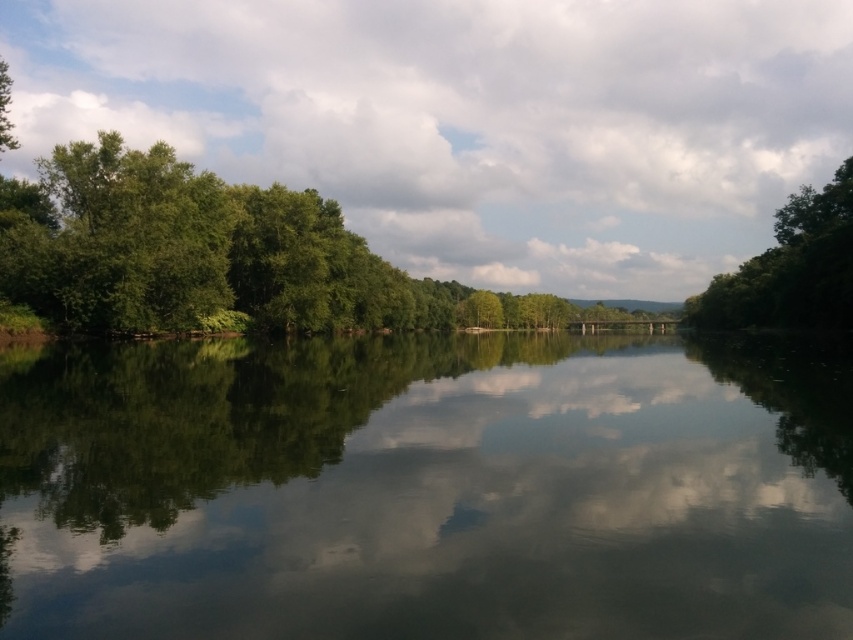
You are standing on the riverside and want to cross to the other side. The green leafy tree at upper center is blocking your view. Can you see the green reflective water at center from your current position?

Yes, because the green reflective water at center is wider than the green leafy tree at upper center, so part of the water will still be visible beyond the tree.

You are a photographer standing at the edge of the river. You want to capture the reflection of the green reflective water at center in your shot. Since reflections are best captured when the camera is positioned at the same height as the water surface, how far above or below the water level should you position your camera to ensure the reflection is clearly visible?

To capture the reflection of the green reflective water at center clearly, position your camera at the same height as the water surface. This ensures the reflection is fully visible without distortion.

You are standing at the point labeled point (729,557) and want to cross the river to the opposite bank. The bridge is 17.26 meters away from your current position. Is the bridge within a 20 meter walking distance?

The bridge is 17.26 meters away from the point labeled point (729,557), so yes, it is within a 20 meter walking distance.